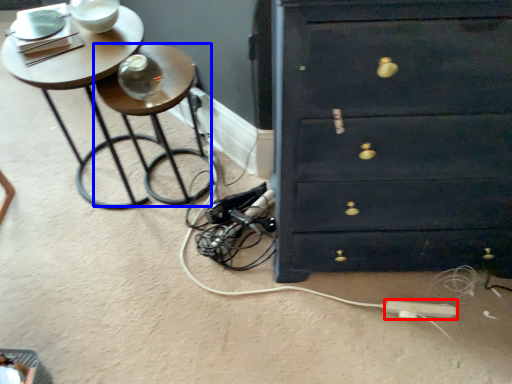
Question: Among these objects, which one is nearest to the camera, extension cord (highlighted by a red box) or side table (highlighted by a blue box)?

Choices:
 (A) extension cord
 (B) side table

Answer: (B)